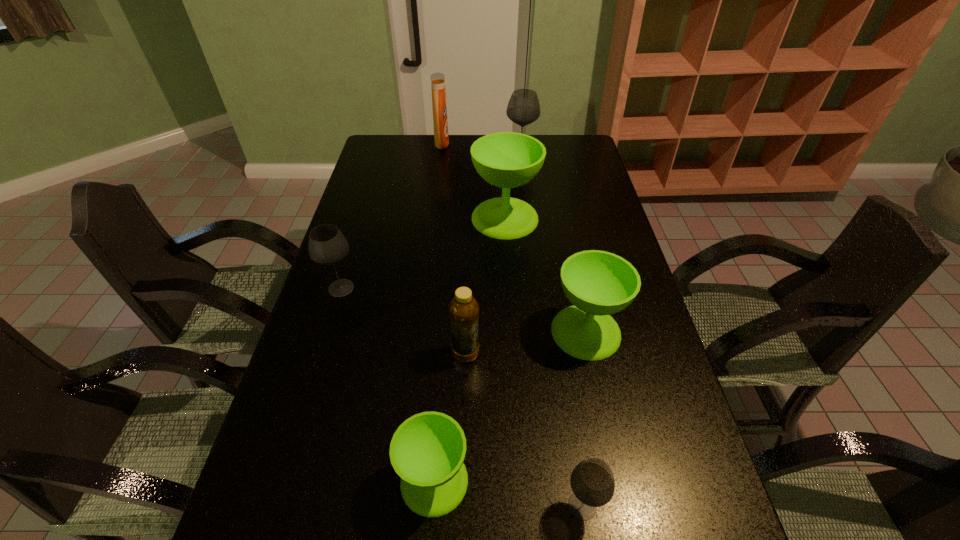
Image resolution: width=960 pixels, height=540 pixels. What are the coordinates of `detergent that is at the far edge` in the screenshot? It's located at (441, 136).

At what (x,y) coordinates should I click in order to perform the action: click on wineglass that is at the far edge. Please return your answer as a coordinate pair (x, y). Image resolution: width=960 pixels, height=540 pixels. Looking at the image, I should click on (523, 108).

You are a GUI agent. You are given a task and a screenshot of the screen. Output one action in this format:
    pyautogui.click(x=<x>, y=<y>)
    Task: Click on the object present at the left edge
    The height and width of the screenshot is (540, 960).
    Given the screenshot: What is the action you would take?
    pyautogui.click(x=327, y=245)

The width and height of the screenshot is (960, 540). I want to click on object that is at the right edge, so click(598, 283).

What are the coordinates of `free region at the far edge` in the screenshot? It's located at (478, 136).

Locate an element on the screen. The width and height of the screenshot is (960, 540). free space at the left edge of the desktop is located at coordinates coord(388,165).

Where is `free location at the right edge`? free location at the right edge is located at coordinates (589, 206).

This screenshot has width=960, height=540. Identify the location of free space between the second nearest green wineglass and the nearest gray wineglass. [584, 418].

Where is `unoccupied position between the nearest green wineglass and the second smallest green wineglass`? unoccupied position between the nearest green wineglass and the second smallest green wineglass is located at coordinates click(510, 406).

Find the location of a particular element. The width and height of the screenshot is (960, 540). free area in between the third farthest wineglass and the bottle is located at coordinates (403, 321).